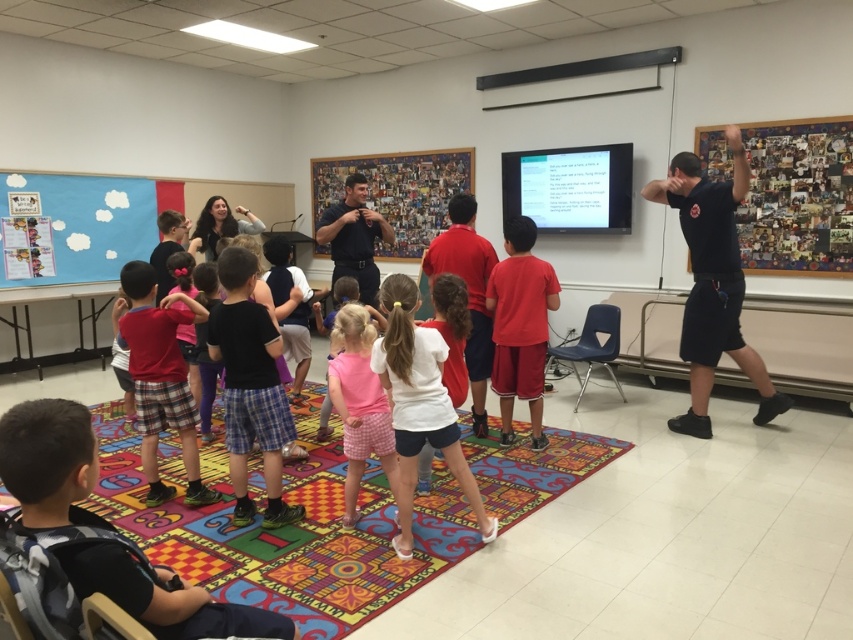
You are a teacher in the classroom. You need to locate the black uniform at upper right. Where is it positioned in the room?

The black uniform at upper right is located at point 0.442 on the x axis and 0.836 on the y axis.

You are a student in the classroom and want to show your friend the matte blue bulletin board at upper left and the white matte shirt at center. Which one is located to the left of the other?

The matte blue bulletin board at upper left is positioned on the left side of white matte shirt at center.